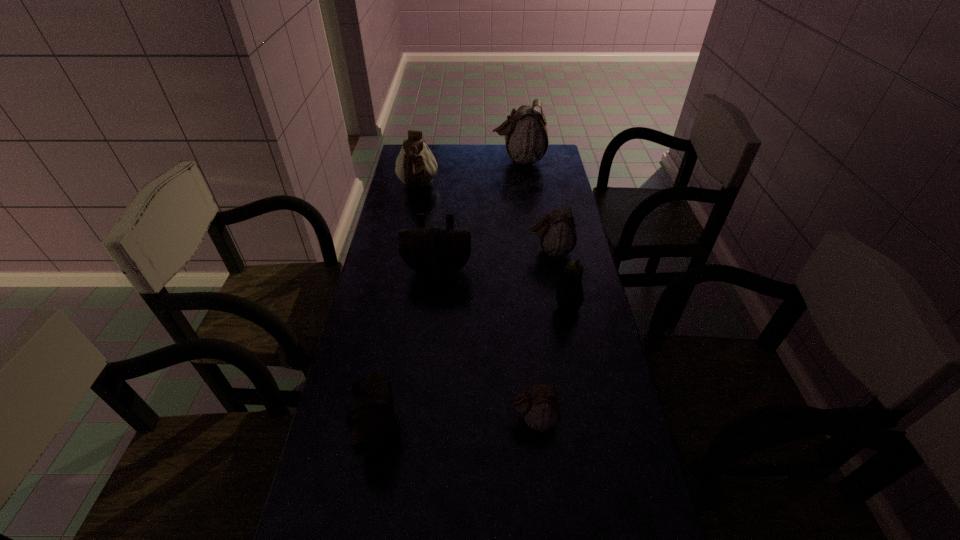
Image resolution: width=960 pixels, height=540 pixels. I want to click on vacant space situated 0.140m on the front-facing side of the farthest pouch, so click(461, 160).

This screenshot has height=540, width=960. Find the location of `vacant space located 0.300m on the front-facing side of the farthest pouch`. vacant space located 0.300m on the front-facing side of the farthest pouch is located at coordinates (426, 160).

Where is `vacant space located 0.380m on the front-facing side of the farthest pouch`? The image size is (960, 540). vacant space located 0.380m on the front-facing side of the farthest pouch is located at coordinates (408, 160).

The height and width of the screenshot is (540, 960). Identify the location of vacant space positioned 0.360m on the front-facing side of the leftmost white pouch. point(404,261).

At what (x,y) coordinates should I click in order to perform the action: click on vacant space positioned 0.240m on the back of the eggplant. Please return your answer as a coordinate pair (x, y). This screenshot has height=540, width=960. Looking at the image, I should click on (556, 248).

This screenshot has width=960, height=540. In order to click on free spot located 0.360m with the flap open on the bigger brown pouch in this screenshot , I will do `click(427, 378)`.

Where is `free space located on the front-facing side of the third biggest white pouch`? This screenshot has width=960, height=540. free space located on the front-facing side of the third biggest white pouch is located at coordinates (478, 251).

This screenshot has height=540, width=960. Find the location of `free space located 0.330m on the front-facing side of the third biggest white pouch`. free space located 0.330m on the front-facing side of the third biggest white pouch is located at coordinates (433, 251).

Identify the location of vacant region located on the front-facing side of the third biggest white pouch. (421, 251).

Locate an element on the screen. vacant space located 0.290m with the flap open on the nearer brown pouch is located at coordinates (519, 433).